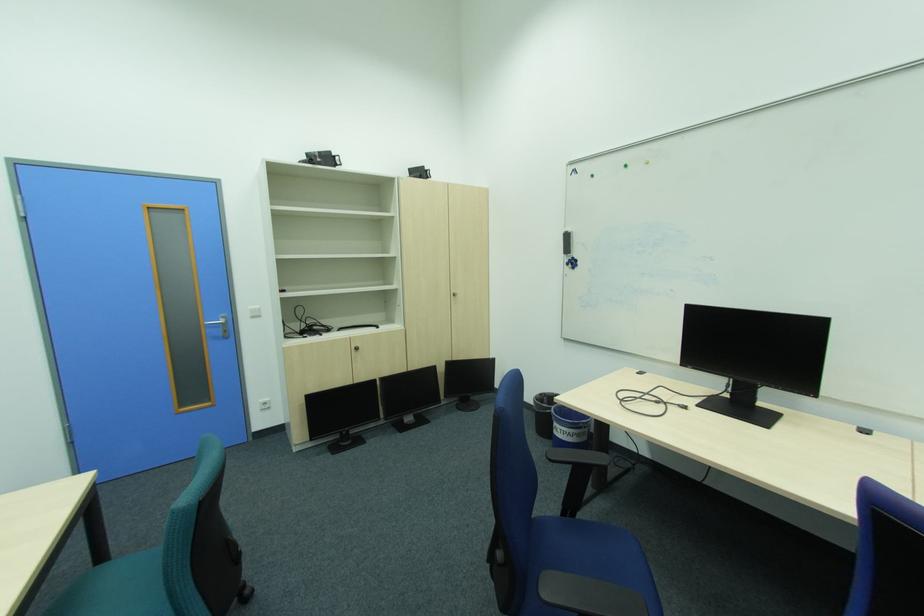
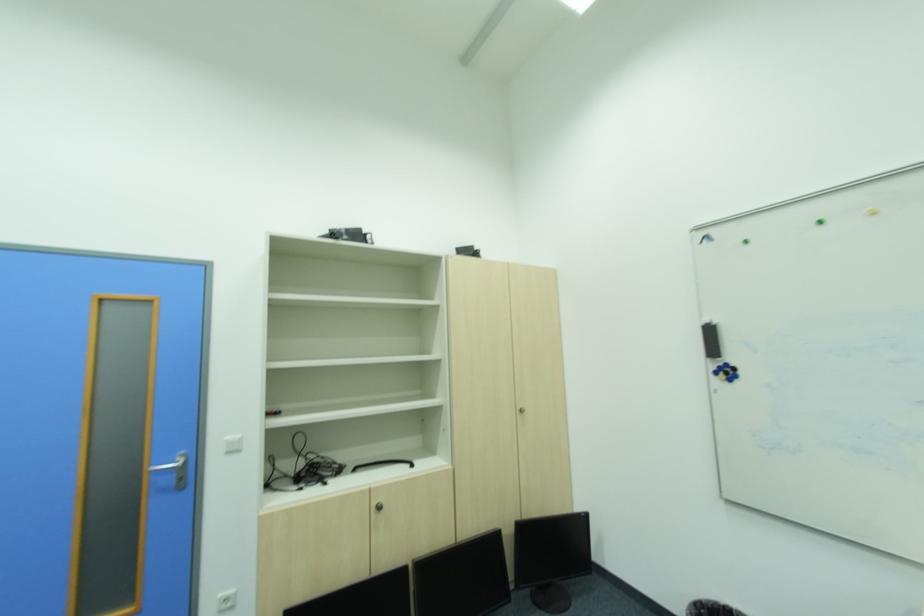
Where in the second image is the point corresponding to point 155,209 from the first image?

(111, 300)